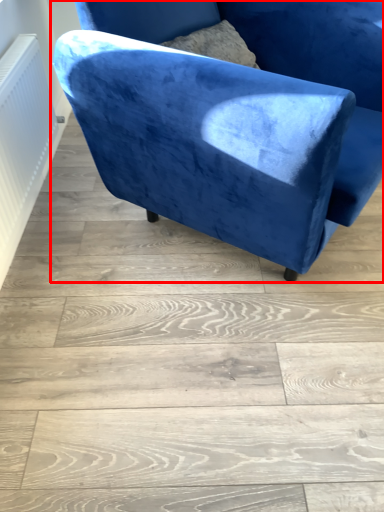
Question: From the image's perspective, considering the relative positions of chair (annotated by the red box) and radiator in the image provided, where is chair (annotated by the red box) located with respect to the staircase?

Choices:
 (A) below
 (B) above

Answer: (B)